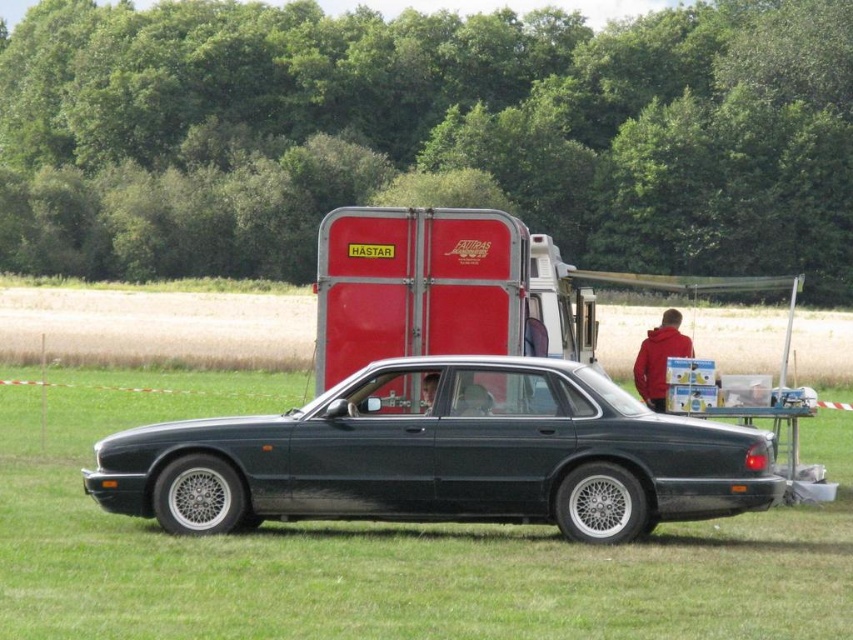
You are standing at the origin point of the coordinate system. You want to move towards the metallic dark green sedan at center. What direction should you move in?

Since the metallic dark green sedan at center is located at coordinate point (444, 456), you should move towards the right and slightly forward to reach it.

You are standing in a rural area and see a dark sedan parked on a grassy field with a red horse trailer behind it. There is a point at coordinates (543,433). Is this point closer to you than 12 meters?

The distance of point (543,433) from the viewer is 11.40 meters, so yes, the point is closer than 12 meters.

You are standing at a point in the countryside where you can see a dark sedan parked on a grassy field and two points marked on a map. The first point is labeled as point (370, 444) and the second as point (653, 376). If you were to walk from the dark sedan towards the direction of the first point, would you be moving towards or away from the second point?

Since point (370, 444) is in front of point (653, 376), walking towards the first point would mean moving away from the second point.